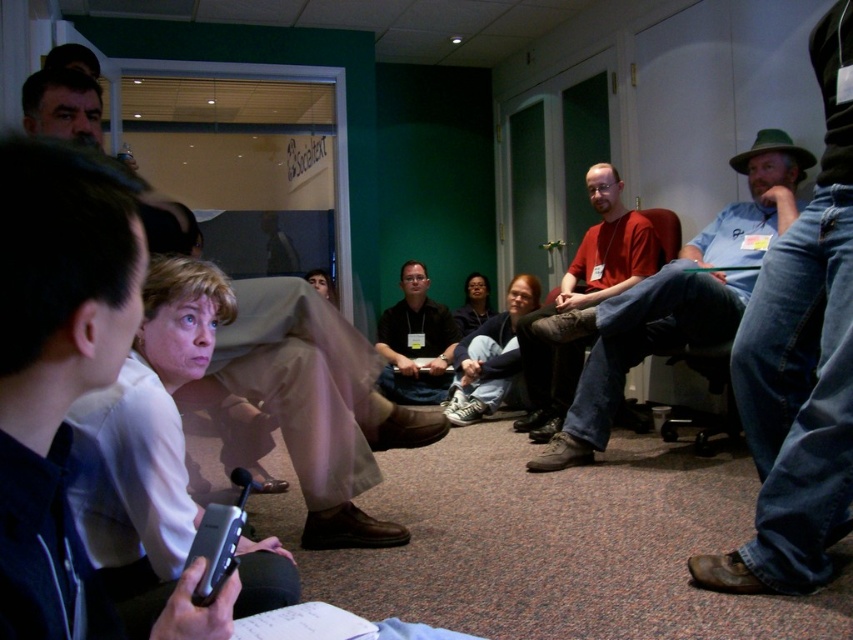
Looking at this image, does light brown fabric pants at lower left come in front of red shirt at center?

Yes, light brown fabric pants at lower left is in front of red shirt at center.

Can you confirm if light brown fabric pants at lower left is thinner than red shirt at center?

Yes.

Identify the location of light brown fabric pants at lower left. (317, 404).

Which is behind, point (32, 269) or point (578, 384)?

Positioned behind is point (578, 384).

Who is higher up, white fabric shirt at upper left or red shirt at center?

red shirt at center is higher up.

You are a GUI agent. You are given a task and a screenshot of the screen. Output one action in this format:
    pyautogui.click(x=<x>, y=<y>)
    Task: Click on the white fabric shirt at upper left
    Image resolution: width=853 pixels, height=640 pixels.
    Given the screenshot: What is the action you would take?
    pyautogui.click(x=56, y=368)

Is red shirt at center to the left of dark brown leather jacket at center from the viewer's perspective?

No, red shirt at center is not to the left of dark brown leather jacket at center.

Who is positioned more to the left, red shirt at center or dark brown leather jacket at center?

Positioned to the left is dark brown leather jacket at center.

Locate an element on the screen. red shirt at center is located at coordinates (682, 298).